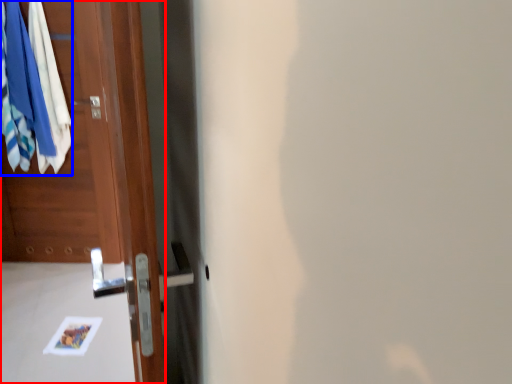
Question: Which object appears farthest to the camera in this image, door (highlighted by a red box) or clothing (highlighted by a blue box)?

Choices:
 (A) door
 (B) clothing

Answer: (B)